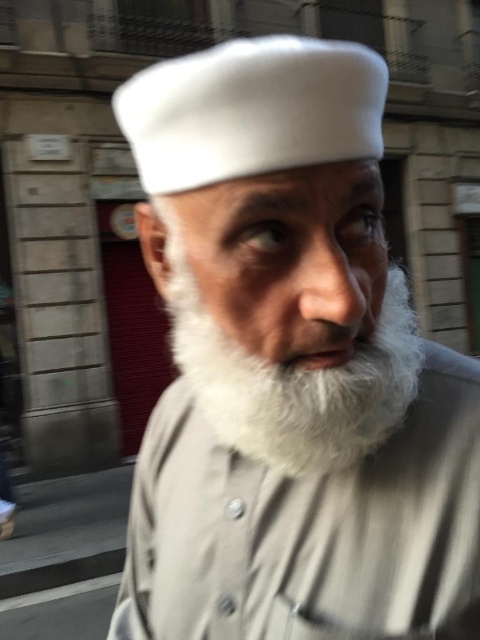
Question: Does white fur beard at center appear on the right side of white felt cap at upper center?

Choices:
 (A) no
 (B) yes

Answer: (B)

Question: Which of the following is the farthest from the observer?

Choices:
 (A) (187, 298)
 (B) (284, 116)
 (C) (260, 573)

Answer: (C)

Question: Among these points, which one is farthest from the camera?

Choices:
 (A) (476, 616)
 (B) (247, 445)

Answer: (B)

Question: Which point is farther to the camera?

Choices:
 (A) white felt cap at upper center
 (B) white soft beard at center

Answer: (A)

Question: Does white fur beard at center have a smaller size compared to white soft beard at center?

Choices:
 (A) yes
 (B) no

Answer: (B)

Question: Can you confirm if white felt cap at upper center is positioned to the left of white soft beard at center?

Choices:
 (A) no
 (B) yes

Answer: (B)